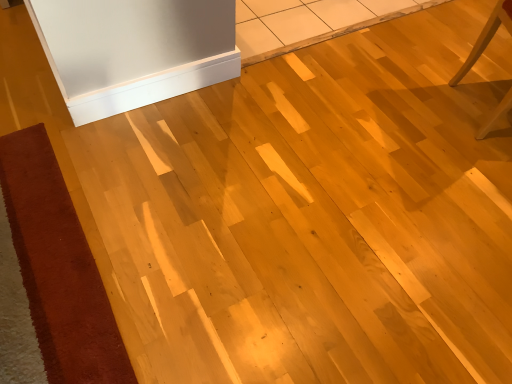
The height and width of the screenshot is (384, 512). I want to click on blank space above white glossy baseboard at upper center (from a real-world perspective), so click(x=145, y=69).